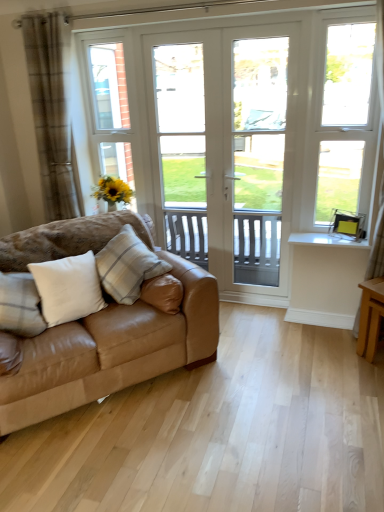
Question: Is white plastic window at right facing away from white glossy window sill at lower right?

Choices:
 (A) yes
 (B) no

Answer: (B)

Question: Considering the relative sizes of white plastic window at right and white glossy window sill at lower right in the image provided, is white plastic window at right taller than white glossy window sill at lower right?

Choices:
 (A) yes
 (B) no

Answer: (A)

Question: Does white plastic window at right turn towards white glossy window sill at lower right?

Choices:
 (A) no
 (B) yes

Answer: (B)

Question: Is the depth of white plastic window at right less than that of white glossy window sill at lower right?

Choices:
 (A) yes
 (B) no

Answer: (A)

Question: Does white plastic window at right appear on the right side of white glossy window sill at lower right?

Choices:
 (A) yes
 (B) no

Answer: (A)

Question: Considering the relative positions of white soft cushion at left, which is the second pillow in right-to-left order, and white textured pillow at center, which appears as the 1th pillow when viewed from the right, in the image provided, is white soft cushion at left, which is the second pillow in right-to-left order, to the left or to the right of white textured pillow at center, which appears as the 1th pillow when viewed from the right,?

Choices:
 (A) left
 (B) right

Answer: (A)

Question: From the image's perspective, relative to white textured pillow at center, acting as the third pillow starting from the left, is white soft cushion at left, which is the second pillow in right-to-left order, above or below?

Choices:
 (A) below
 (B) above

Answer: (A)

Question: From a real-world perspective, relative to white textured pillow at center, acting as the third pillow starting from the left, is white soft cushion at left, acting as the 2th pillow starting from the left, vertically above or below?

Choices:
 (A) above
 (B) below

Answer: (B)

Question: Is white soft cushion at left, which is the second pillow in right-to-left order, taller or shorter than white textured pillow at center, which appears as the 1th pillow when viewed from the right?

Choices:
 (A) tall
 (B) short

Answer: (B)

Question: From their relative heights in the image, would you say white textured pillow at center, acting as the third pillow starting from the left, is taller or shorter than brown plaid curtain at left?

Choices:
 (A) tall
 (B) short

Answer: (B)

Question: Considering their positions, is white textured pillow at center, acting as the third pillow starting from the left, located in front of or behind brown plaid curtain at left?

Choices:
 (A) behind
 (B) front

Answer: (B)

Question: Is white textured pillow at center, acting as the third pillow starting from the left, inside or outside of brown plaid curtain at left?

Choices:
 (A) inside
 (B) outside

Answer: (B)

Question: From a real-world perspective, is white textured pillow at center, which appears as the 1th pillow when viewed from the right, physically located above or below brown plaid curtain at left?

Choices:
 (A) above
 (B) below

Answer: (B)

Question: From a real-world perspective, is white plastic window at right positioned above or below white soft pillow at lower left, the third pillow viewed from the right?

Choices:
 (A) above
 (B) below

Answer: (A)

Question: Is white plastic window at right inside or outside of white soft pillow at lower left, which is the 1th pillow from left to right?

Choices:
 (A) outside
 (B) inside

Answer: (A)